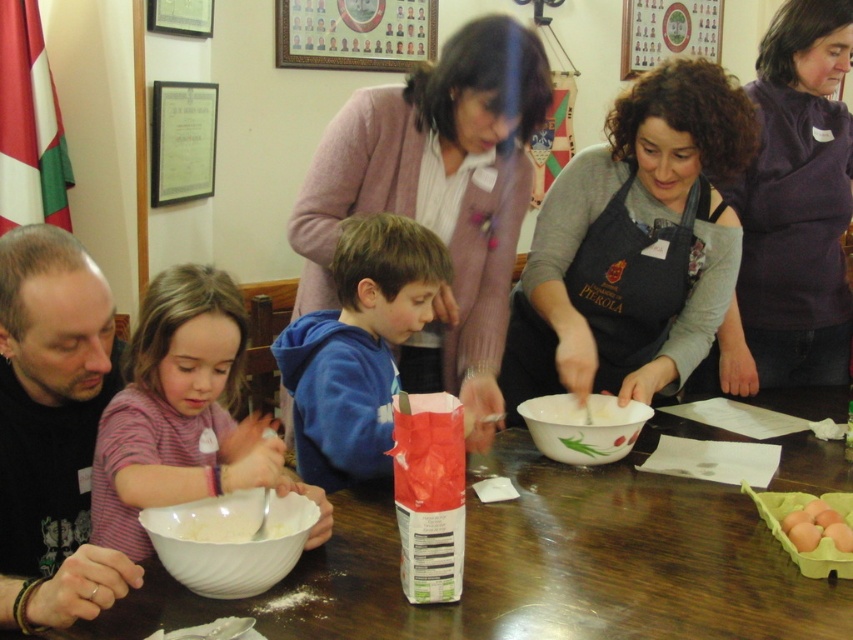
Can you confirm if wooden table at center is positioned above brown paper egg carton at lower right?

Incorrect, wooden table at center is not positioned above brown paper egg carton at lower right.

Does point (357, 525) come farther from viewer compared to point (827, 536)?

That is True.

Where is `wooden table at center`? The height and width of the screenshot is (640, 853). wooden table at center is located at coordinates (532, 564).

Can you confirm if blue fleece hoodie at center is shorter than white glossy bowl at center?

In fact, blue fleece hoodie at center may be taller than white glossy bowl at center.

Is point (297, 442) closer to viewer compared to point (614, 413)?

Yes, point (297, 442) is closer to viewer.

This screenshot has height=640, width=853. I want to click on blue fleece hoodie at center, so click(x=358, y=348).

Is pink striped shirt at left wider than white glossy bowl at center?

Yes.

Describe the element at coordinates (183, 413) in the screenshot. I see `pink striped shirt at left` at that location.

Find the location of `pink striped shirt at left`. pink striped shirt at left is located at coordinates (183, 413).